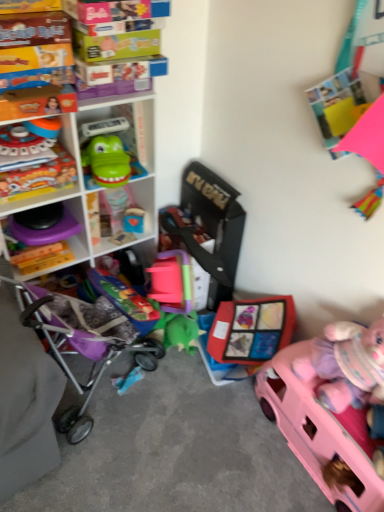
The height and width of the screenshot is (512, 384). I want to click on free location in front of purple fabric baby carriage at lower left, so click(x=107, y=470).